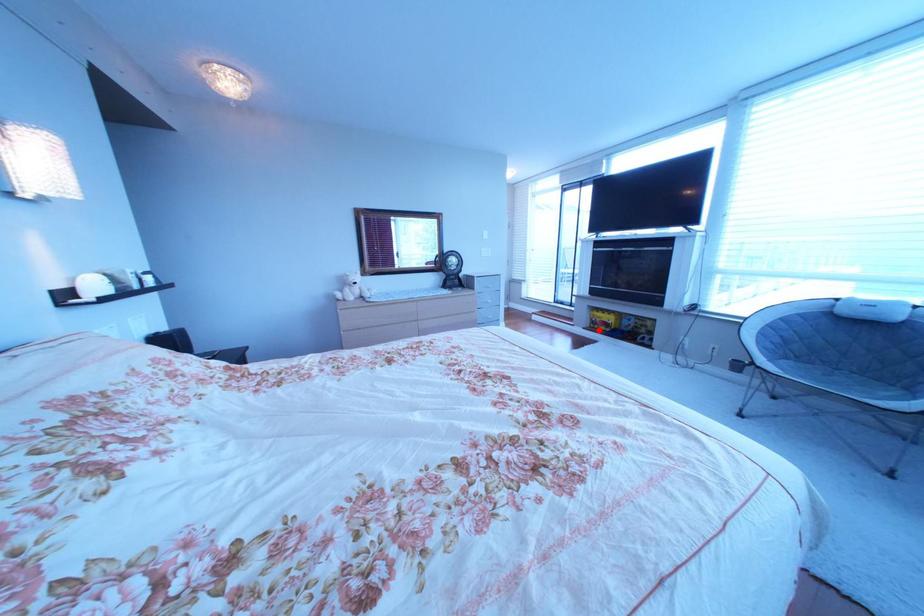
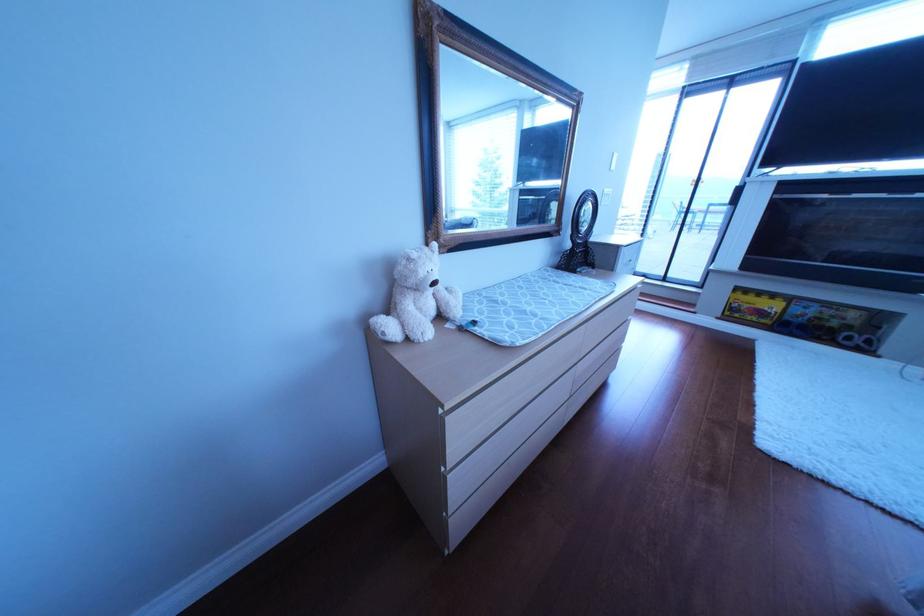
Question: A red point is marked in image1. In image2, is the corresponding 3D point closer to the camera or farther? Reply with the corresponding letter.

Choices:
 (A) The corresponding 3D point is closer.
 (B) The corresponding 3D point is farther.

Answer: (A)